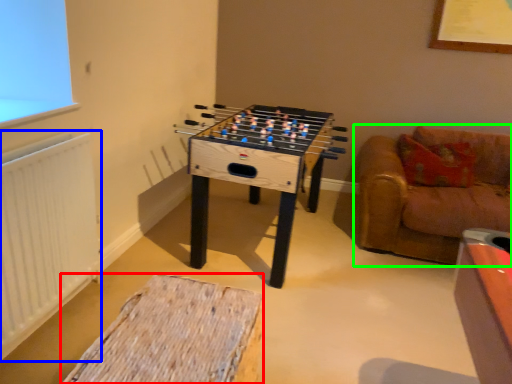
Question: Estimate the real-world distances between objects in this image. Which object is closer to furniture (highlighted by a red box), radiator (highlighted by a blue box) or studio couch (highlighted by a green box)?

Choices:
 (A) radiator
 (B) studio couch

Answer: (A)